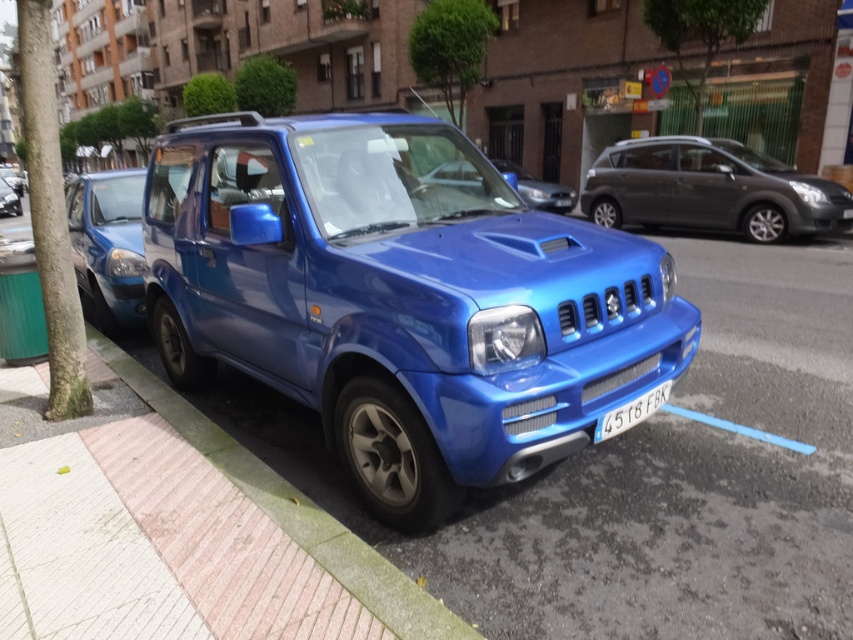
Looking at this image, between metallic gray minivan at center and metallic blue car at center, which one has less height?

With less height is metallic gray minivan at center.

From the picture: Does metallic gray minivan at center have a larger size compared to metallic blue car at center?

No, metallic gray minivan at center is not bigger than metallic blue car at center.

Does point (656, 196) come behind point (498, 163)?

No.

At what (x,y) coordinates should I click in order to perform the action: click on metallic gray minivan at center. Please return your answer as a coordinate pair (x, y). This screenshot has width=853, height=640. Looking at the image, I should click on (711, 189).

Which is behind, point (432, 179) or point (19, 198)?

Point (19, 198)

Is point (563, 202) behind point (15, 204)?

No, it is in front of (15, 204).

Identify the location of metallic blue car at center. The width and height of the screenshot is (853, 640). (537, 188).

Describe the element at coordinates (294, 512) in the screenshot. This screenshot has width=853, height=640. I see `brick at lower left` at that location.

The image size is (853, 640). What are the coordinates of `brick at lower left` in the screenshot? It's located at (294, 512).

Is point (283, 520) less distant than point (618, 413)?

Yes.

Find the location of a particular element. Image resolution: width=853 pixels, height=640 pixels. brick at lower left is located at coordinates (294, 512).